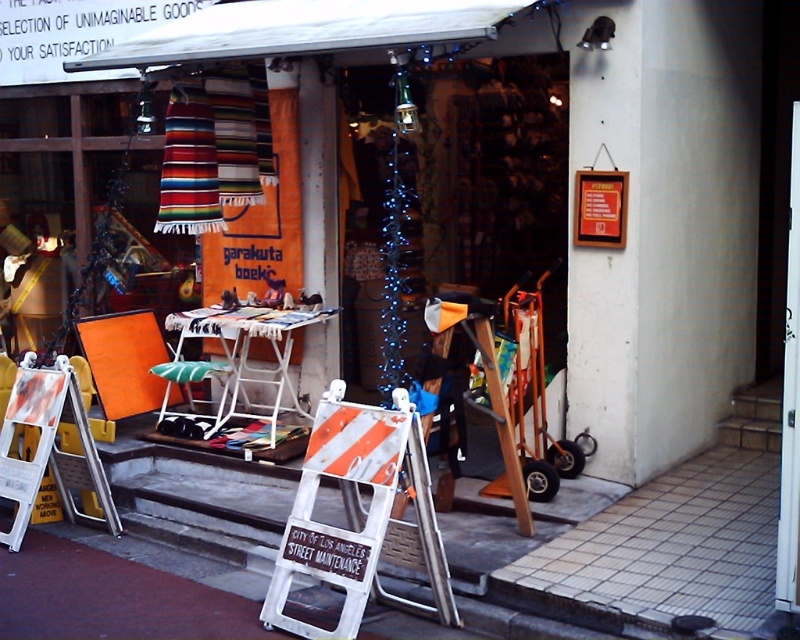
Who is taller, matte black sign at center or white plastic ladder at center?

Standing taller between the two is matte black sign at center.

Consider the image. Is matte black sign at center shorter than white plastic ladder at center?

Incorrect, matte black sign at center's height does not fall short of white plastic ladder at center's.

Image resolution: width=800 pixels, height=640 pixels. Identify the location of matte black sign at center. (468, 184).

At what (x,y) coordinates should I click in order to perform the action: click on matte black sign at center. Please return your answer as a coordinate pair (x, y). This screenshot has height=640, width=800. Looking at the image, I should click on (468, 184).